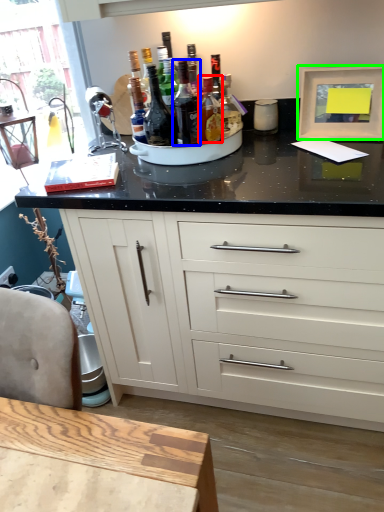
Question: Which is farther away from bottle (highlighted by a red box)? bottle (highlighted by a blue box) or picture frame (highlighted by a green box)?

Choices:
 (A) bottle
 (B) picture frame

Answer: (B)